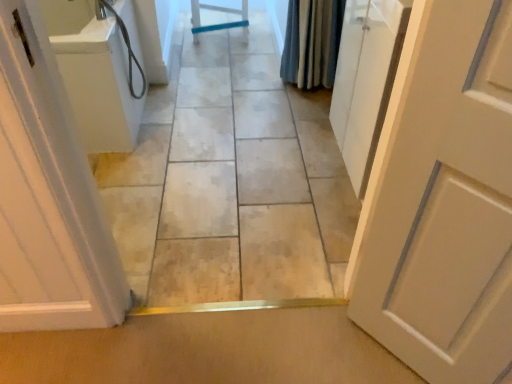
Find the location of a particular element. The height and width of the screenshot is (384, 512). free space between blue textured fabric shower curtain at upper right and white glossy door at left, which ranks as the first door in left-to-right order is located at coordinates (223, 153).